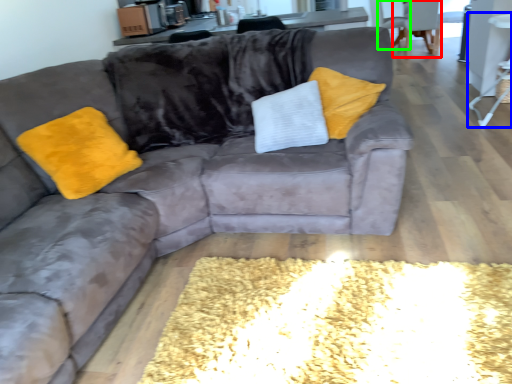
Question: Estimate the real-world distances between objects in this image. Which object is farther from armchair (highlighted by a red box), side table (highlighted by a blue box) or armchair (highlighted by a green box)?

Choices:
 (A) side table
 (B) armchair

Answer: (A)